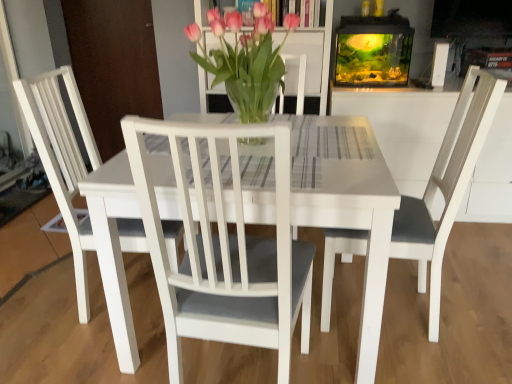
Question: Based on their positions, is white matte chair at center, the 2th chair positioned from the left, located to the left or right of white matte chair at center, which is the first chair from left to right?

Choices:
 (A) right
 (B) left

Answer: (A)

Question: From the image's perspective, is white matte chair at center, the 1th chair positioned from the right, located above or below white matte chair at center, which is the first chair from left to right?

Choices:
 (A) above
 (B) below

Answer: (B)

Question: Which is farther from the white matte chair at center, the 2th chair positioned from the left?

Choices:
 (A) white matte chair at center, which is the first chair from left to right
 (B) translucent glass vase at center

Answer: (A)

Question: Which object is the closest to the translucent glass vase at center?

Choices:
 (A) white matte chair at center, which is the first chair from left to right
 (B) white matte chair at center, the 2th chair positioned from the left

Answer: (B)